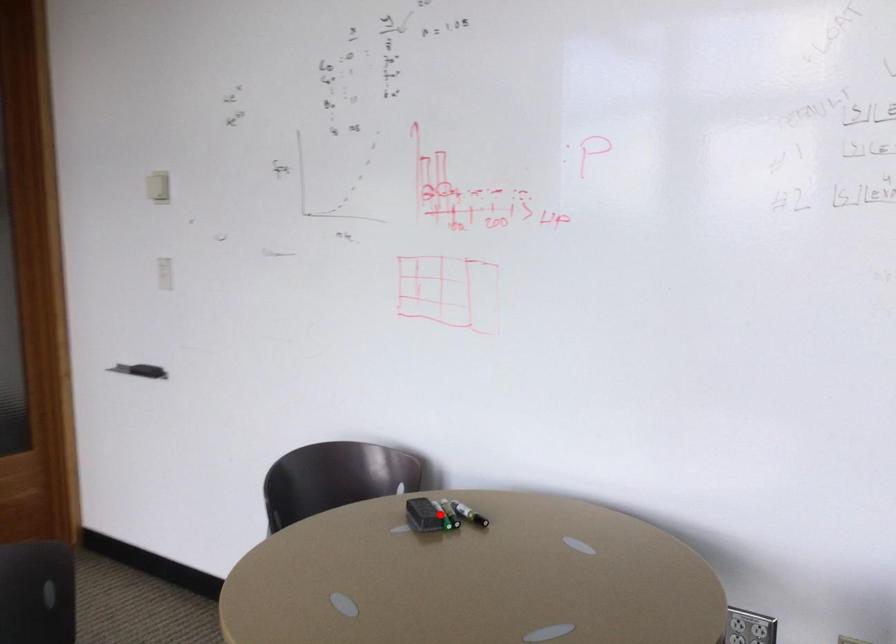
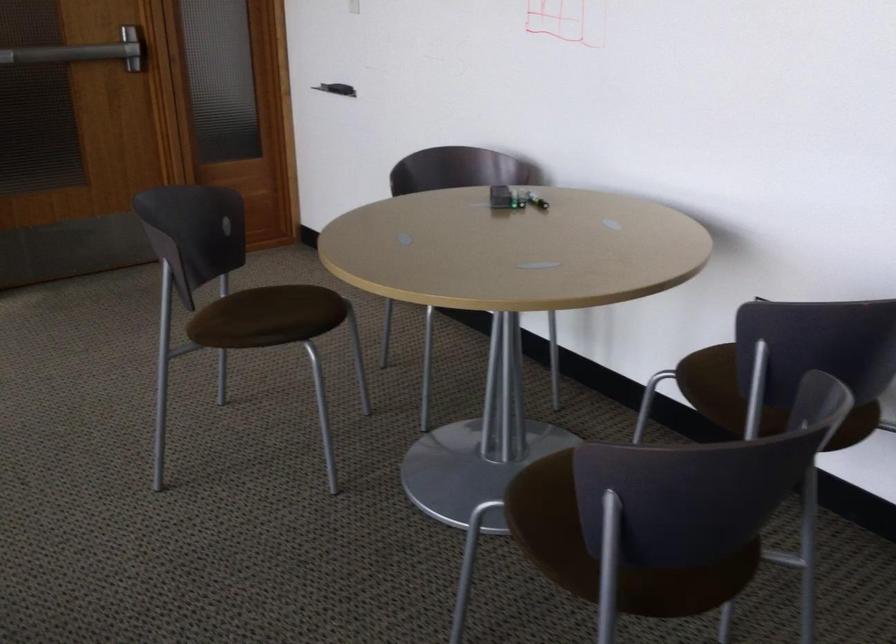
Question: I am providing you with two images of the same scene from different viewpoints. A red point is shown in image1. For the corresponding object point in image2, is it positioned nearer or farther from the camera?

Choices:
 (A) Nearer
 (B) Farther

Answer: (B)